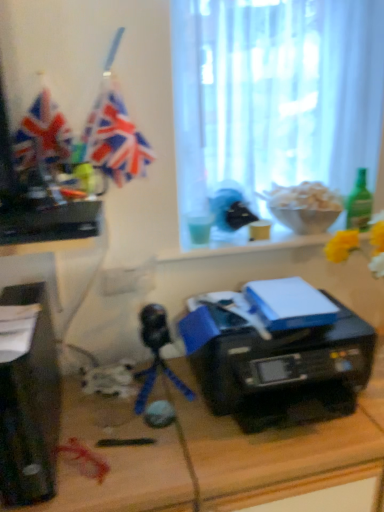
Question: Can you confirm if green glass bottle at right is smaller than black plastic desktop computer at left?

Choices:
 (A) yes
 (B) no

Answer: (A)

Question: From a real-world perspective, is green glass bottle at right physically below black plastic desktop computer at left?

Choices:
 (A) no
 (B) yes

Answer: (A)

Question: From the image's perspective, is green glass bottle at right located beneath black plastic desktop computer at left?

Choices:
 (A) yes
 (B) no

Answer: (B)

Question: Does green glass bottle at right appear on the left side of black plastic desktop computer at left?

Choices:
 (A) no
 (B) yes

Answer: (A)

Question: Is green glass bottle at right next to black plastic desktop computer at left?

Choices:
 (A) no
 (B) yes

Answer: (A)

Question: In the image, is black plastic desktop computer at left positioned in front of or behind white sheer curtain at upper center?

Choices:
 (A) behind
 (B) front

Answer: (B)

Question: In the image, is black plastic desktop computer at left on the left side or the right side of white sheer curtain at upper center?

Choices:
 (A) left
 (B) right

Answer: (A)

Question: Looking at their shapes, would you say black plastic desktop computer at left is wider or thinner than white sheer curtain at upper center?

Choices:
 (A) thin
 (B) wide

Answer: (B)

Question: Is black plastic desktop computer at left bigger or smaller than white sheer curtain at upper center?

Choices:
 (A) small
 (B) big

Answer: (A)

Question: Looking at their shapes, would you say matte plastic flag at upper left is wider or thinner than white sheer curtain at upper center?

Choices:
 (A) wide
 (B) thin

Answer: (B)

Question: From the image's perspective, relative to white sheer curtain at upper center, is matte plastic flag at upper left above or below?

Choices:
 (A) above
 (B) below

Answer: (B)

Question: Is matte plastic flag at upper left bigger or smaller than white sheer curtain at upper center?

Choices:
 (A) big
 (B) small

Answer: (B)

Question: Is matte plastic flag at upper left taller or shorter than white sheer curtain at upper center?

Choices:
 (A) tall
 (B) short

Answer: (B)

Question: From the image's perspective, is translucent plastic cup at window located above or below black plastic printer at center?

Choices:
 (A) above
 (B) below

Answer: (A)

Question: Is translucent plastic cup at window bigger or smaller than black plastic printer at center?

Choices:
 (A) big
 (B) small

Answer: (B)